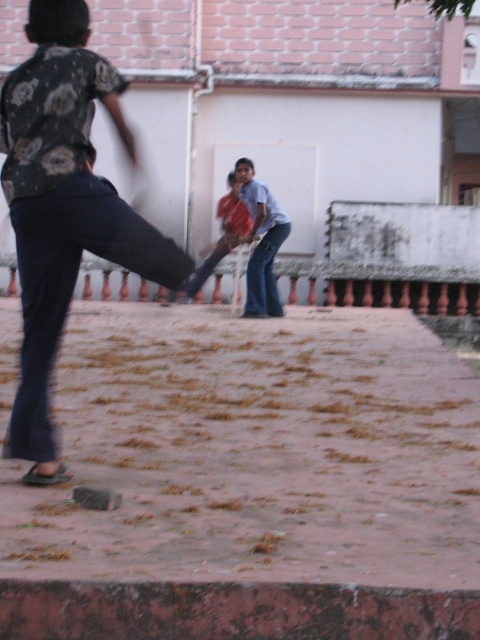
Can you confirm if dark blue jeans at center is smaller than reddish-orange fabric at center?

Incorrect, dark blue jeans at center is not smaller in size than reddish-orange fabric at center.

Between dark blue jeans at center and reddish-orange fabric at center, which one appears on the right side from the viewer's perspective?

reddish-orange fabric at center is more to the right.

Which is behind, point (140, 244) or point (243, 209)?

Positioned behind is point (243, 209).

The height and width of the screenshot is (640, 480). I want to click on dark blue jeans at center, so click(x=63, y=205).